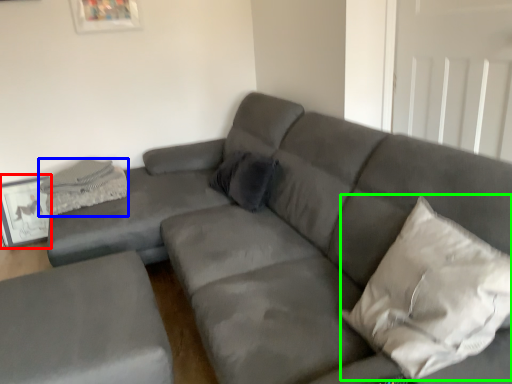
Question: Which is nearer to the picture frame (highlighted by a red box)? material (highlighted by a blue box) or pillow (highlighted by a green box).

Choices:
 (A) material
 (B) pillow

Answer: (A)